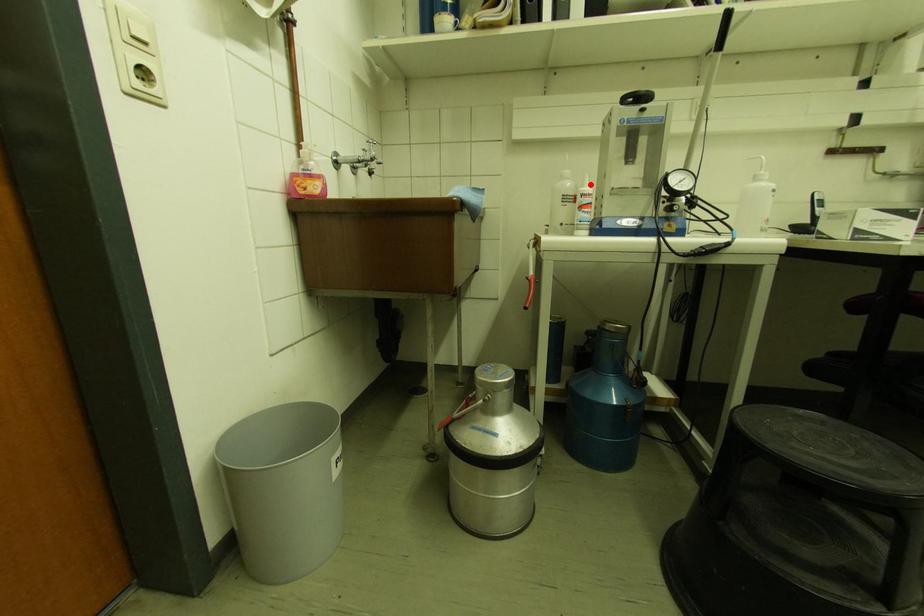
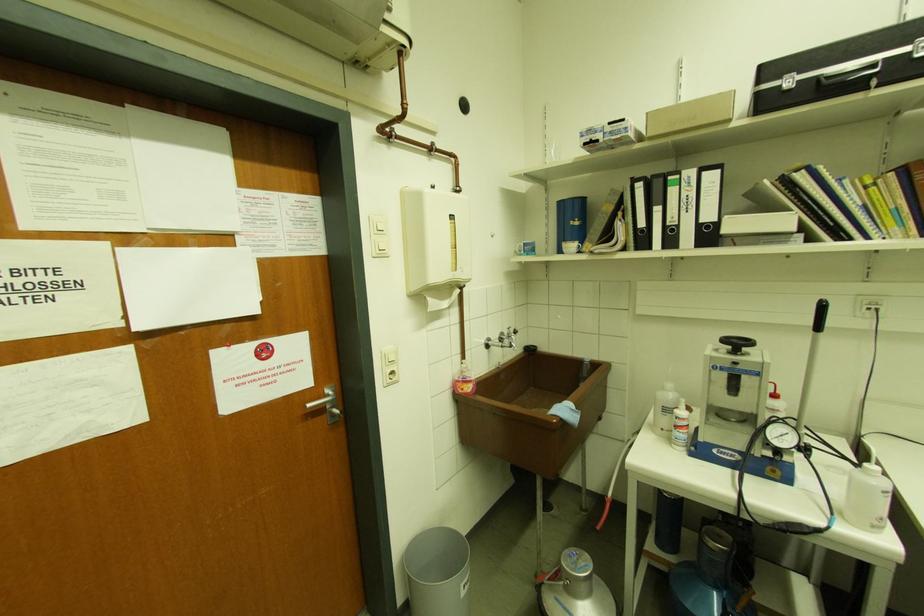
Find the pixel in the second image that matches the highlighted location in the first image.

(687, 408)